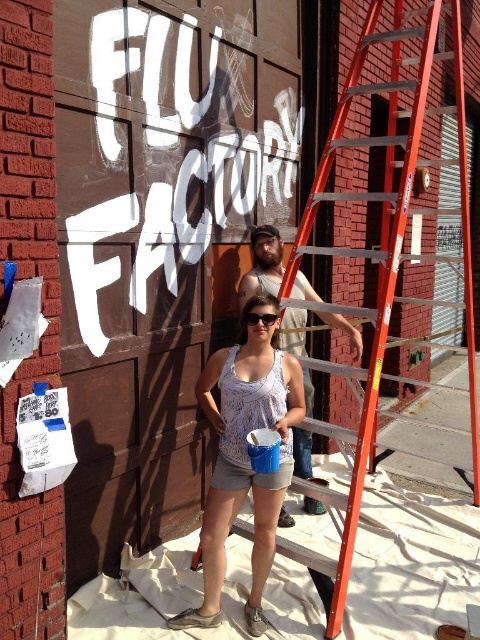
You are standing at the bottom of the orange metallic ladder at center. You want to climb up to the top. Is the ladder positioned in a way that allows you to reach the top without needing to move it?

The orange metallic ladder at center is positioned at point (386,240), so yes, you can climb it to the top without needing to move it.

You are a photographer trying to capture the model wearing the white printed tank top at center and the black plastic goggles at center. Which item is positioned more to the left side of the model?

The white printed tank top at center is positioned to the left of the black plastic goggles at center, so the white printed tank top at center is more to the left side of the model.

You are a photographer trying to capture the details of the white printed tank top at center and the black plastic goggles at center. Which object should you focus on first if you want to ensure both are in frame without moving the camera?

The white printed tank top at center has a greater height compared to the black plastic goggles at center, so you should focus on the white printed tank top at center first to ensure both fit in the frame.